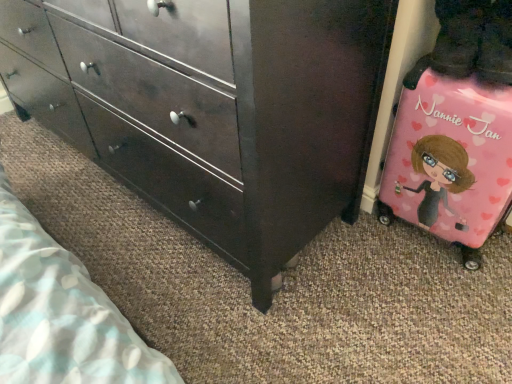
The image size is (512, 384). What do you see at coordinates (212, 108) in the screenshot?
I see `matte dark wood chest of drawers at center` at bounding box center [212, 108].

This screenshot has height=384, width=512. In order to click on matte dark wood chest of drawers at center in this screenshot , I will do coord(212,108).

The width and height of the screenshot is (512, 384). What do you see at coordinates (449, 159) in the screenshot?
I see `pink glossy suitcase at lower right` at bounding box center [449, 159].

What is the approximate width of pink glossy suitcase at lower right?

pink glossy suitcase at lower right is 9.38 inches wide.

What is the approximate height of pink glossy suitcase at lower right?

pink glossy suitcase at lower right is 21.30 inches in height.

Where is `pink glossy suitcase at lower right`? pink glossy suitcase at lower right is located at coordinates (449, 159).

Find the location of `matte dark wood chest of drawers at center`. matte dark wood chest of drawers at center is located at coordinates (212, 108).

Which is more to the left, pink glossy suitcase at lower right or matte dark wood chest of drawers at center?

From the viewer's perspective, matte dark wood chest of drawers at center appears more on the left side.

Which object is closer to the camera taking this photo, pink glossy suitcase at lower right or matte dark wood chest of drawers at center?

matte dark wood chest of drawers at center is closer to the camera.

Does point (440, 114) appear closer or farther from the camera than point (362, 24)?

Clearly, point (440, 114) is more distant from the camera than point (362, 24).

From the image's perspective, is pink glossy suitcase at lower right under matte dark wood chest of drawers at center?

Correct, pink glossy suitcase at lower right appears lower than matte dark wood chest of drawers at center in the image.

From a real-world perspective, which object rests below the other?

pink glossy suitcase at lower right.

Considering the sizes of objects pink glossy suitcase at lower right and matte dark wood chest of drawers at center in the image provided, who is thinner, pink glossy suitcase at lower right or matte dark wood chest of drawers at center?

pink glossy suitcase at lower right.

From their relative heights in the image, would you say pink glossy suitcase at lower right is taller or shorter than matte dark wood chest of drawers at center?

pink glossy suitcase at lower right is shorter than matte dark wood chest of drawers at center.

Considering the sizes of objects pink glossy suitcase at lower right and matte dark wood chest of drawers at center in the image provided, who is bigger, pink glossy suitcase at lower right or matte dark wood chest of drawers at center?

Bigger between the two is matte dark wood chest of drawers at center.

Based on the photo, is matte dark wood chest of drawers at center a part of pink glossy suitcase at lower right?

No, pink glossy suitcase at lower right does not contain matte dark wood chest of drawers at center.

Is pink glossy suitcase at lower right in contact with matte dark wood chest of drawers at center?

No, pink glossy suitcase at lower right is not beside matte dark wood chest of drawers at center.

Is pink glossy suitcase at lower right aimed at matte dark wood chest of drawers at center?

No, pink glossy suitcase at lower right is not aimed at matte dark wood chest of drawers at center.

Could you measure the distance between pink glossy suitcase at lower right and matte dark wood chest of drawers at center?

pink glossy suitcase at lower right is 15.67 inches from matte dark wood chest of drawers at center.

Find the location of `luggage below the matte dark wood chest of drawers at center (from a real-world perspective)`. luggage below the matte dark wood chest of drawers at center (from a real-world perspective) is located at coordinates (449, 159).

Considering the relative positions of matte dark wood chest of drawers at center and pink glossy suitcase at lower right in the image provided, is matte dark wood chest of drawers at center to the left of pink glossy suitcase at lower right from the viewer's perspective?

Yes.

In the image, is matte dark wood chest of drawers at center positioned in front of or behind pink glossy suitcase at lower right?

Clearly, matte dark wood chest of drawers at center is in front of pink glossy suitcase at lower right.

Considering the positions of points (103, 27) and (441, 154), is point (103, 27) farther from camera compared to point (441, 154)?

No, it is in front of (441, 154).

From the image's perspective, is matte dark wood chest of drawers at center beneath pink glossy suitcase at lower right?

No, from the image's perspective, matte dark wood chest of drawers at center is not beneath pink glossy suitcase at lower right.

From a real-world perspective, who is located lower, matte dark wood chest of drawers at center or pink glossy suitcase at lower right?

pink glossy suitcase at lower right is physically lower.

Looking at their sizes, would you say matte dark wood chest of drawers at center is wider or thinner than pink glossy suitcase at lower right?

matte dark wood chest of drawers at center is wider than pink glossy suitcase at lower right.

Considering the sizes of objects matte dark wood chest of drawers at center and pink glossy suitcase at lower right in the image provided, who is taller, matte dark wood chest of drawers at center or pink glossy suitcase at lower right?

matte dark wood chest of drawers at center.

Considering the sizes of matte dark wood chest of drawers at center and pink glossy suitcase at lower right in the image, is matte dark wood chest of drawers at center bigger or smaller than pink glossy suitcase at lower right?

matte dark wood chest of drawers at center is bigger than pink glossy suitcase at lower right.

Is matte dark wood chest of drawers at center inside the boundaries of pink glossy suitcase at lower right, or outside?

matte dark wood chest of drawers at center is spatially situated outside pink glossy suitcase at lower right.

Is matte dark wood chest of drawers at center in contact with pink glossy suitcase at lower right?

No.

Is matte dark wood chest of drawers at center looking in the opposite direction of pink glossy suitcase at lower right?

matte dark wood chest of drawers at center does not have its back to pink glossy suitcase at lower right.

Could you measure the distance between matte dark wood chest of drawers at center and pink glossy suitcase at lower right?

matte dark wood chest of drawers at center and pink glossy suitcase at lower right are 15.67 inches apart from each other.

Locate an element on the screen. the chest of drawers above the pink glossy suitcase at lower right (from the image's perspective) is located at coordinates (212, 108).

Locate an element on the screen. This screenshot has height=384, width=512. luggage below the matte dark wood chest of drawers at center (from a real-world perspective) is located at coordinates (449, 159).

Identify the location of chest of drawers above the pink glossy suitcase at lower right (from the image's perspective). This screenshot has height=384, width=512. (212, 108).